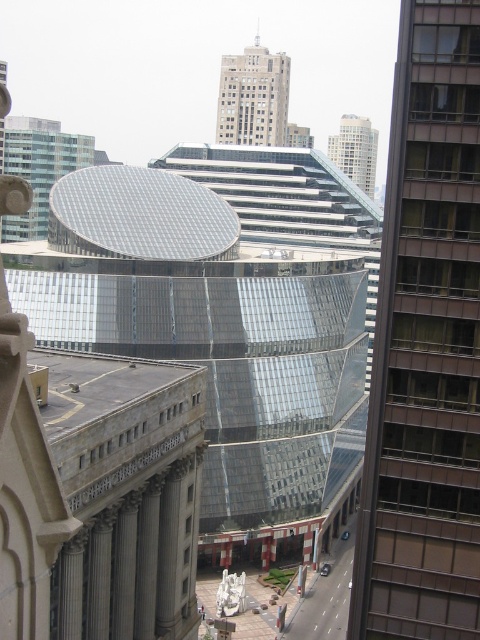
Question: Which point is closer to the camera?

Choices:
 (A) coord(357,131)
 (B) coord(284,131)

Answer: (B)

Question: Is gray stone column at center smaller than gray stone column at lower left?

Choices:
 (A) no
 (B) yes

Answer: (A)

Question: Estimate the real-world distances between objects in this image. Which object is closer to the white glass building at upper center?

Choices:
 (A) gray concrete skyscraper at center
 (B) dark gray stone column at center
 (C) gray stone column at center

Answer: (A)

Question: Is gray concrete skyscraper at center thinner than gray stone column at center?

Choices:
 (A) yes
 (B) no

Answer: (B)

Question: Is gray concrete skyscraper at center positioned behind white glass building at upper center?

Choices:
 (A) yes
 (B) no

Answer: (B)

Question: Which is farther from the glassy reflective skyscraper at right?

Choices:
 (A) gray concrete skyscraper at center
 (B) gray stone column at lower left
 (C) gray stone column at center
 (D) white glass building at upper center

Answer: (D)